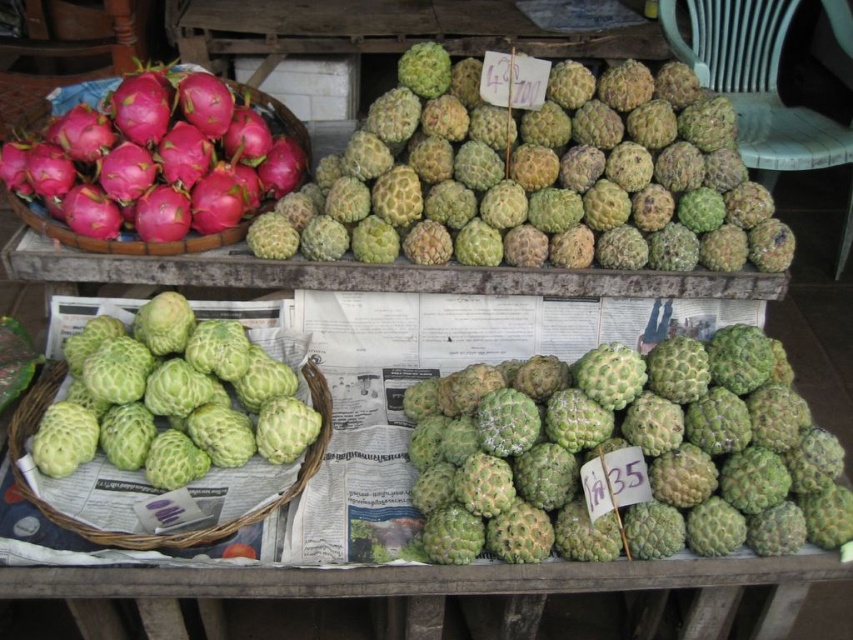
You are a customer at the market stall and want to buy both the green matte cherimoya at center and the pink matte dragon fruit basket at left. If you start from the entrance of the stall, which fruit should you approach first to reach them in the correct order?

The pink matte dragon fruit basket at left is to the left of the green matte cherimoya at center, so you should approach the pink matte dragon fruit basket at left first before moving to the green matte cherimoya at center.

You are a customer at the market stall and want to buy both the green rough durian at upper center and the green matte cherimoya at center. However, your shopping bag can only hold items that are narrower than 30 centimeters. Can you determine if both items will fit in your bag based on their widths?

The green rough durian at upper center might be wider than green matte cherimoya at center. Since the description states that the durian might be wider, it could exceed the 30 cm limit. Therefore, it is uncertain if both will fit without knowing the exact width of the durian.